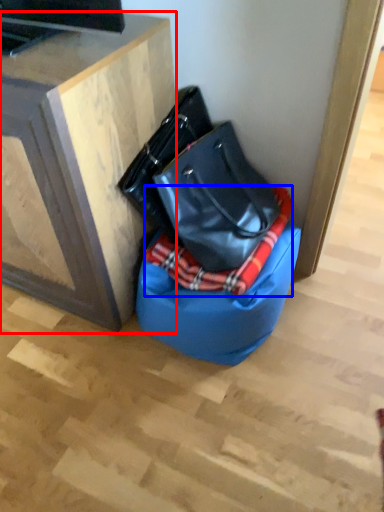
Question: Among these objects, which one is farthest to the camera, furniture (highlighted by a red box) or blanket (highlighted by a blue box)?

Choices:
 (A) furniture
 (B) blanket

Answer: (B)